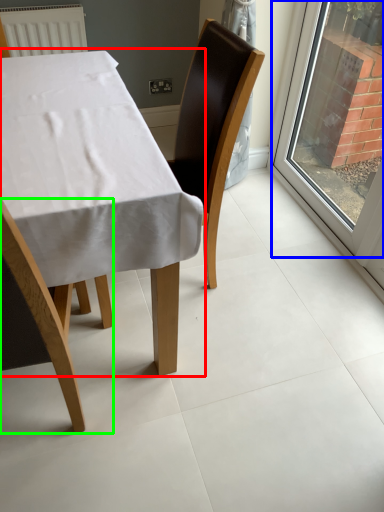
Question: Estimate the real-world distances between objects in this image. Which object is farther from table (highlighted by a red box), window (highlighted by a blue box) or chair (highlighted by a green box)?

Choices:
 (A) window
 (B) chair

Answer: (A)